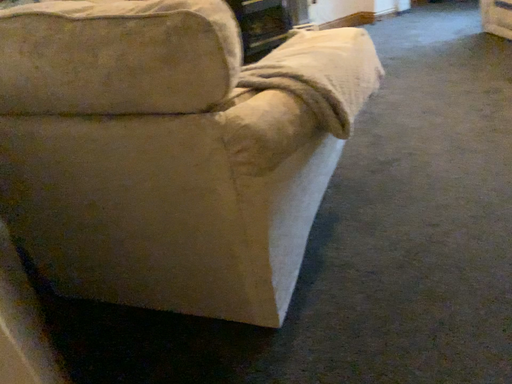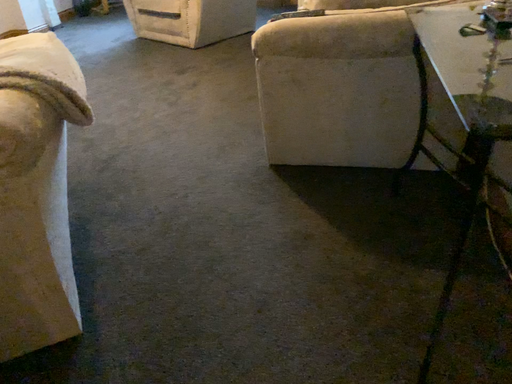
Question: Which way did the camera rotate in the video?

Choices:
 (A) rotated left
 (B) rotated right

Answer: (B)